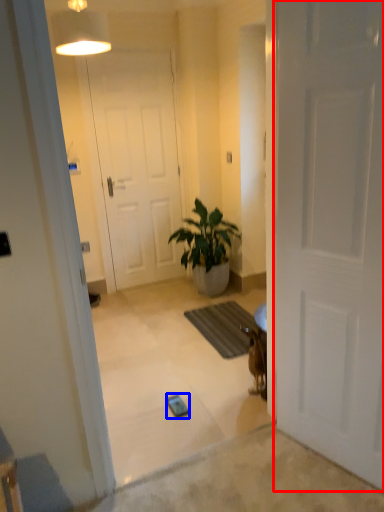
Question: Which object appears farthest to the camera in this image, door (highlighted by a red box) or mobile phone (highlighted by a blue box)?

Choices:
 (A) door
 (B) mobile phone

Answer: (B)